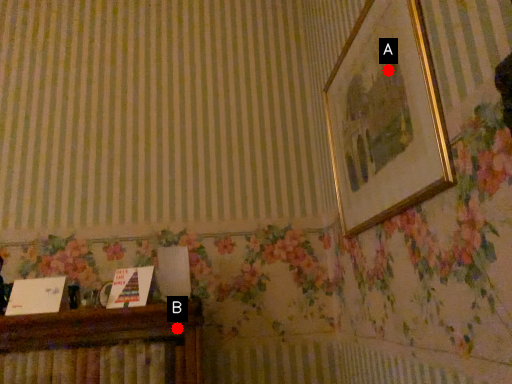
Question: Two points are circled on the image, labeled by A and B beside each circle. Which point is closer to the camera taking this photo?

Choices:
 (A) A is closer
 (B) B is closer

Answer: (A)